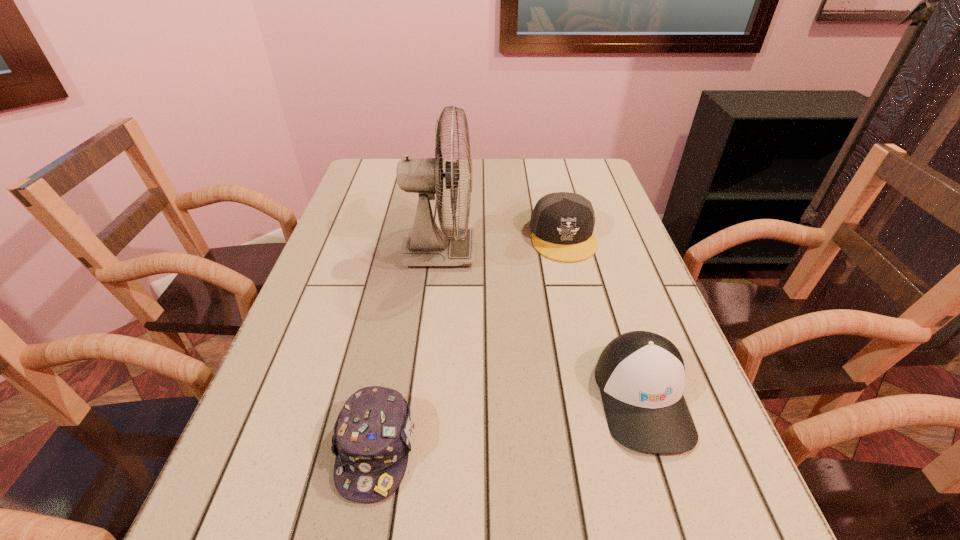
Where is `the tallest object`? the tallest object is located at coordinates (427, 245).

Identify the location of the farthest headwear. This screenshot has height=540, width=960. (562, 223).

Where is `the shortest object`? the shortest object is located at coordinates (372, 438).

Image resolution: width=960 pixels, height=540 pixels. I want to click on the shortest headwear, so click(372, 438).

You are a GUI agent. You are given a task and a screenshot of the screen. Output one action in this format:
    pyautogui.click(x=<x>, y=<y>)
    Task: Click on the vacant space located 0.080m on the front-facing side of the tallest object
    
    Given the screenshot: What is the action you would take?
    pyautogui.click(x=506, y=252)

At what (x,y) coordinates should I click in order to perform the action: click on vacant space located 0.090m on the front-facing side of the farthest headwear. Please return your answer as a coordinate pair (x, y). The width and height of the screenshot is (960, 540). Looking at the image, I should click on tap(575, 287).

In the image, there is a desktop. At what (x,y) coordinates should I click in order to perform the action: click on blank space at the far edge. Please return your answer as a coordinate pair (x, y). The height and width of the screenshot is (540, 960). Looking at the image, I should click on (514, 164).

Find the location of `blank space at the near edge`. blank space at the near edge is located at coordinates (399, 538).

In the image, there is a desktop. Where is `free space at the left edge`? Image resolution: width=960 pixels, height=540 pixels. free space at the left edge is located at coordinates (372, 232).

You are a GUI agent. You are given a task and a screenshot of the screen. Output one action in this format:
    pyautogui.click(x=<x>, y=<y>)
    Task: Click on the blank space at the right edge of the desktop
    Image resolution: width=960 pixels, height=540 pixels.
    Given the screenshot: What is the action you would take?
    pyautogui.click(x=598, y=259)